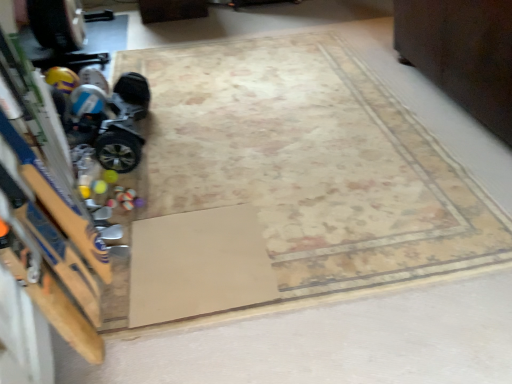
This screenshot has height=384, width=512. Describe the element at coordinates (197, 265) in the screenshot. I see `brown cardboard at center` at that location.

In order to face beige carpet at center, should I rotate leftwards or rightwards?

A 0.828 degree turn to the right will do.

This screenshot has width=512, height=384. What do you see at coordinates (462, 53) in the screenshot?
I see `dark wood dresser at upper right` at bounding box center [462, 53].

This screenshot has width=512, height=384. In order to click on shiny metallic hoverboard at left in this screenshot , I will do `click(106, 120)`.

Considering the relative positions of shiny metallic hoverboard at left and brown cardboard at center in the image provided, is shiny metallic hoverboard at left to the left or to the right of brown cardboard at center?

shiny metallic hoverboard at left is to the left of brown cardboard at center.

Does shiny metallic hoverboard at left contain brown cardboard at center?

Definitely not — brown cardboard at center is not inside shiny metallic hoverboard at left.

Considering the relative sizes of shiny metallic hoverboard at left and brown cardboard at center in the image provided, is shiny metallic hoverboard at left wider than brown cardboard at center?

In fact, shiny metallic hoverboard at left might be narrower than brown cardboard at center.

Relative to brown cardboard at center, is shiny metallic hoverboard at left in front or behind?

Visually, shiny metallic hoverboard at left is located behind brown cardboard at center.

Based on their positions, is dark wood dresser at upper right located to the left or right of shiny metallic hoverboard at left?

From the image, it's evident that dark wood dresser at upper right is to the right of shiny metallic hoverboard at left.

Is point (493, 23) positioned before point (80, 91)?

Yes, it is.

Looking at this image, is dark wood dresser at upper right bigger than beige carpet at center?

Yes, dark wood dresser at upper right is bigger than beige carpet at center.

Can you confirm if dark wood dresser at upper right is wider than beige carpet at center?

No, dark wood dresser at upper right is not wider than beige carpet at center.

Would you say dark wood dresser at upper right is outside beige carpet at center?

Indeed, dark wood dresser at upper right is completely outside beige carpet at center.

Is brown cardboard at center to the right of dark wood dresser at upper right from the viewer's perspective?

No, brown cardboard at center is not to the right of dark wood dresser at upper right.

Which is more distant, (152,267) or (489,56)?

Positioned behind is point (489,56).

Is brown cardboard at center in contact with dark wood dresser at upper right?

There is a gap between brown cardboard at center and dark wood dresser at upper right.

From the image's perspective, which one is positioned lower, brown cardboard at center or dark wood dresser at upper right?

brown cardboard at center.

Is beige carpet at center taller than shiny metallic hoverboard at left?

Incorrect, the height of beige carpet at center is not larger of that of shiny metallic hoverboard at left.

What's the angular difference between beige carpet at center and shiny metallic hoverboard at left's facing directions?

The facing directions of beige carpet at center and shiny metallic hoverboard at left are 5 degrees apart.

Who is more distant, beige carpet at center or shiny metallic hoverboard at left?

shiny metallic hoverboard at left is behind.

Which is more to the left, shiny metallic hoverboard at left or dark wood dresser at upper right?

shiny metallic hoverboard at left is more to the left.

Are shiny metallic hoverboard at left and dark wood dresser at upper right far apart?

Indeed, shiny metallic hoverboard at left is not near dark wood dresser at upper right.

Between shiny metallic hoverboard at left and dark wood dresser at upper right, which one is positioned in front?

dark wood dresser at upper right is more forward.

Does beige carpet at center turn towards dark wood dresser at upper right?

Yes, beige carpet at center is turned towards dark wood dresser at upper right.

Is point (266, 232) farther from viewer compared to point (507, 49)?

No, it is in front of (507, 49).

In terms of width, does beige carpet at center look wider or thinner when compared to dark wood dresser at upper right?

Clearly, beige carpet at center has more width compared to dark wood dresser at upper right.

From a real-world perspective, between beige carpet at center and dark wood dresser at upper right, who is vertically higher?

dark wood dresser at upper right, from a real-world perspective.

You are a GUI agent. You are given a task and a screenshot of the screen. Output one action in this format:
    pyautogui.click(x=<x>, y=<y>)
    Task: Click on the doormat in front of the shiny metallic hoverboard at left
    The height and width of the screenshot is (384, 512).
    Given the screenshot: What is the action you would take?
    pyautogui.click(x=197, y=265)

This screenshot has width=512, height=384. What are the coordinates of `toy car on the left of the dark wood dresser at upper right` in the screenshot? It's located at (106, 120).

From the image, which object appears to be nearer to beige carpet at center, dark wood dresser at upper right or shiny metallic hoverboard at left?

shiny metallic hoverboard at left is closer to beige carpet at center.

From the image, which object appears to be farther from shiny metallic hoverboard at left, beige carpet at center or brown cardboard at center?

Based on the image, brown cardboard at center appears to be further to shiny metallic hoverboard at left.

Based on their spatial positions, is dark wood dresser at upper right or shiny metallic hoverboard at left further from brown cardboard at center?

Among the two, dark wood dresser at upper right is located further to brown cardboard at center.

Estimate the real-world distances between objects in this image. Which object is closer to dark wood dresser at upper right, beige carpet at center or shiny metallic hoverboard at left?

Based on the image, beige carpet at center appears to be nearer to dark wood dresser at upper right.

From the image, which object appears to be nearer to dark wood dresser at upper right, shiny metallic hoverboard at left or beige carpet at center?

beige carpet at center lies closer to dark wood dresser at upper right than the other object.

In the scene shown: Considering their positions, is brown cardboard at center positioned further to beige carpet at center than dark wood dresser at upper right?

dark wood dresser at upper right.

Based on their spatial positions, is beige carpet at center or shiny metallic hoverboard at left closer to brown cardboard at center?

Based on the image, beige carpet at center appears to be nearer to brown cardboard at center.

When comparing their distances from beige carpet at center, does shiny metallic hoverboard at left or dark wood dresser at upper right seem further?

dark wood dresser at upper right is further to beige carpet at center.

Identify the location of mat between shiny metallic hoverboard at left and brown cardboard at center in the vertical direction. The image size is (512, 384). (310, 163).

The height and width of the screenshot is (384, 512). Identify the location of mat situated between shiny metallic hoverboard at left and dark wood dresser at upper right from left to right. (310, 163).

The width and height of the screenshot is (512, 384). I want to click on mat between brown cardboard at center and dark wood dresser at upper right in the horizontal direction, so click(310, 163).

Locate an element on the screen. The width and height of the screenshot is (512, 384). doormat between shiny metallic hoverboard at left and dark wood dresser at upper right from left to right is located at coordinates (197, 265).